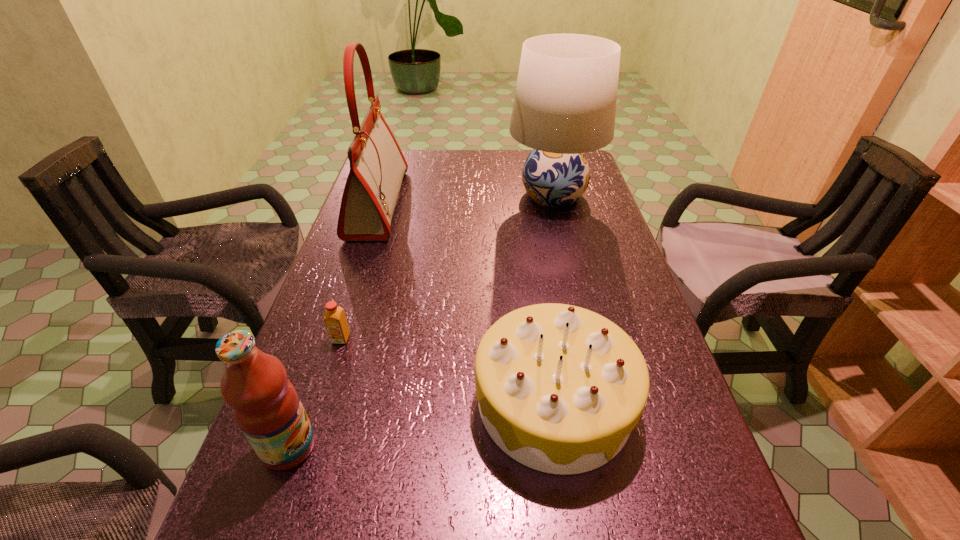
Identify the location of object situated at the far right corner. This screenshot has width=960, height=540. (565, 101).

At what (x,y) coordinates should I click in order to perform the action: click on free space at the left edge of the desktop. Please return your answer as a coordinate pair (x, y). This screenshot has width=960, height=540. Looking at the image, I should click on (342, 398).

The width and height of the screenshot is (960, 540). In the image, there is a desktop. Identify the location of free space at the right edge. (644, 319).

In order to click on free spot between the lampshade and the orange juice in this screenshot , I will do `click(447, 267)`.

Find the location of a particular element. free spot between the orange juice and the fourth tallest object is located at coordinates (447, 370).

In order to click on vacant region between the fourth tallest object and the handbag in this screenshot , I will do tap(466, 302).

This screenshot has height=540, width=960. Find the location of `vacant space that's between the lampshade and the handbag`. vacant space that's between the lampshade and the handbag is located at coordinates (466, 199).

You are a GUI agent. You are given a task and a screenshot of the screen. Output one action in this format:
    pyautogui.click(x=<x>, y=<y>)
    Task: Click on the free space between the lampshade and the handbag
    This screenshot has height=540, width=960.
    Given the screenshot: What is the action you would take?
    pyautogui.click(x=466, y=199)

Locate an element on the screen. vacant space that's between the orange juice and the birthday cake is located at coordinates coord(447,370).

This screenshot has width=960, height=540. I want to click on vacant space that is in between the shortest object and the lampshade, so click(x=447, y=267).